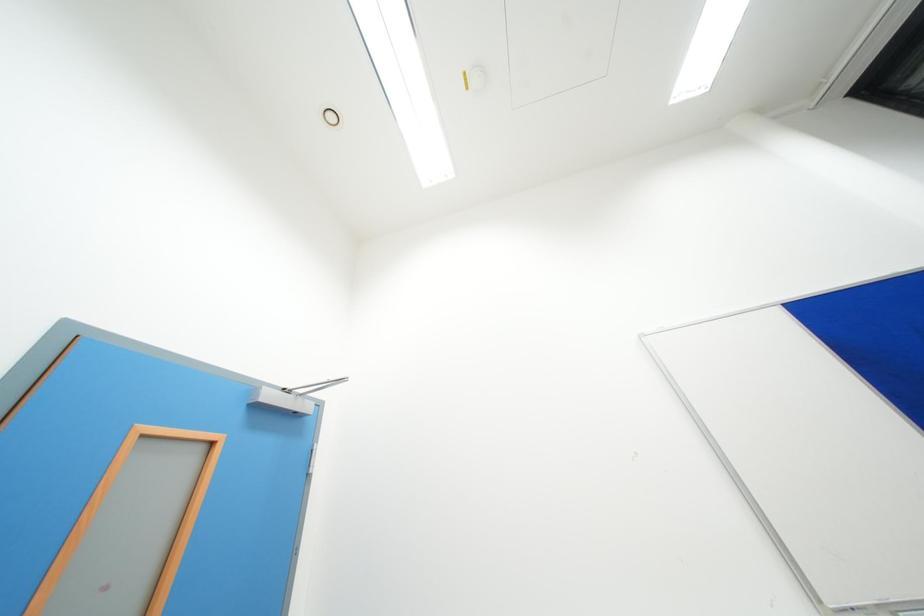
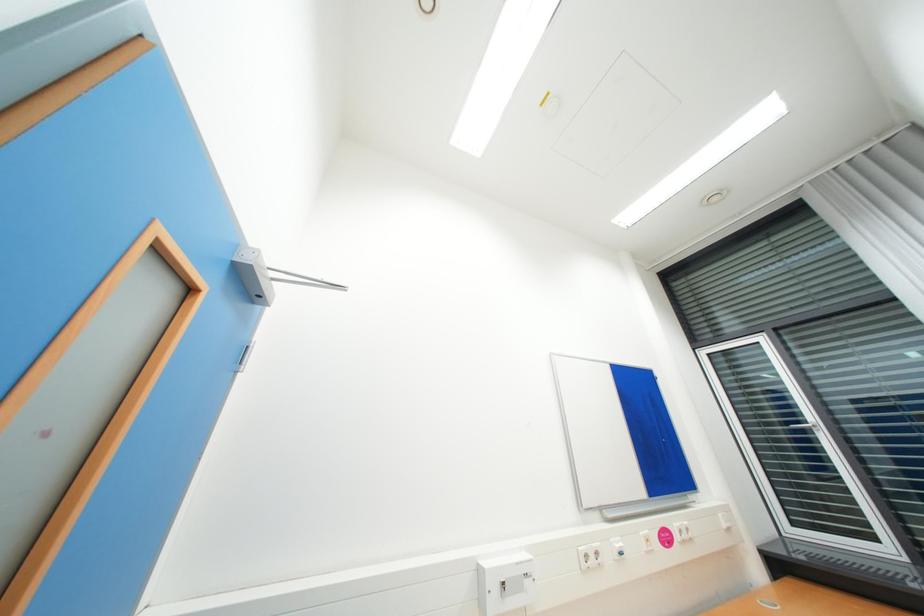
Question: Based on the continuous images, in which direction is the camera rotating? Reply with the corresponding letter.

Choices:
 (A) Left
 (B) Right
 (C) Up
 (D) Down

Answer: (B)